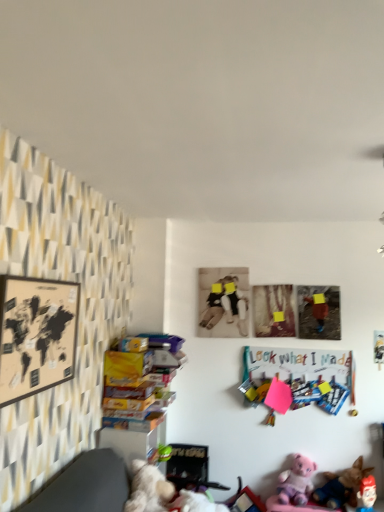
The height and width of the screenshot is (512, 384). Describe the element at coordinates (319, 312) in the screenshot. I see `matte plastic picture frame at upper right, the second picture frame when ordered from front to back` at that location.

What do you see at coordinates (342, 486) in the screenshot?
I see `soft plush dog at lower right, the second toy viewed from the right` at bounding box center [342, 486].

Locate an element on the screen. This screenshot has height=512, width=384. fluffy white teddy bear at lower center, the 1th toy when ordered from left to right is located at coordinates (163, 493).

The height and width of the screenshot is (512, 384). Describe the element at coordinates (296, 481) in the screenshot. I see `pink plush bear at lower right, which is the 2th toy from left to right` at that location.

At what (x,y) coordinates should I click in order to perform the action: click on wooden map at left, which ranks as the first picture frame in front-to-back order. Please return your answer as a coordinate pair (x, y). The image size is (384, 512). Looking at the image, I should click on (36, 335).

Where is `matte plastic picture frame at upper right, the first picture frame viewed from the right`? The width and height of the screenshot is (384, 512). matte plastic picture frame at upper right, the first picture frame viewed from the right is located at coordinates (319, 312).

Is sepia-toned photo at center, arranged as the 2th picture frame when viewed from the left, in contact with fluffy white teddy bear at lower center, acting as the 1th toy starting from the front?

sepia-toned photo at center, arranged as the 2th picture frame when viewed from the left, and fluffy white teddy bear at lower center, acting as the 1th toy starting from the front, are clearly separated.

Consider the image. Is sepia-toned photo at center, which is counted as the third picture frame, starting from the front, looking in the opposite direction of fluffy white teddy bear at lower center, which is the 4th toy in back-to-front order?

sepia-toned photo at center, which is counted as the third picture frame, starting from the front, does not have its back to fluffy white teddy bear at lower center, which is the 4th toy in back-to-front order.

Find the location of `the 2nd picture frame behind the fluffy white teddy bear at lower center, acting as the 1th toy starting from the front, counting from the anchor's position`. the 2nd picture frame behind the fluffy white teddy bear at lower center, acting as the 1th toy starting from the front, counting from the anchor's position is located at coordinates (223, 302).

Is matte plastic picture frame at upper right, the second picture frame when ordered from front to back, positioned with its back to soft plush dog at lower right, arranged as the 3th toy when viewed from the front?

No, matte plastic picture frame at upper right, the second picture frame when ordered from front to back,'s orientation is not away from soft plush dog at lower right, arranged as the 3th toy when viewed from the front.

Considering the sizes of objects matte plastic picture frame at upper right, the 3th picture frame in the left-to-right sequence, and soft plush dog at lower right, arranged as the 3th toy when viewed from the front, in the image provided, who is taller, matte plastic picture frame at upper right, the 3th picture frame in the left-to-right sequence, or soft plush dog at lower right, arranged as the 3th toy when viewed from the front,?

Standing taller between the two is matte plastic picture frame at upper right, the 3th picture frame in the left-to-right sequence.

How much distance is there between matte plastic picture frame at upper right, the first picture frame viewed from the right, and soft plush dog at lower right, placed as the second toy when sorted from back to front?

They are 3.56 feet apart.

Considering the relative positions of matte plastic picture frame at upper right, which is the second picture frame in back-to-front order, and soft plush dog at lower right, the second toy viewed from the right, in the image provided, is matte plastic picture frame at upper right, which is the second picture frame in back-to-front order, to the right of soft plush dog at lower right, the second toy viewed from the right, from the viewer's perspective?

No, matte plastic picture frame at upper right, which is the second picture frame in back-to-front order, is not to the right of soft plush dog at lower right, the second toy viewed from the right.

What's the angular difference between sepia-toned photo at center, which is counted as the third picture frame, starting from the front, and wooden map at left, the 3th picture frame positioned from the back,'s facing directions?

They differ by 89.1 degrees in their facing directions.

Is sepia-toned photo at center, arranged as the 1th picture frame when viewed from the back, turned away from wooden map at left, the 3th picture frame positioned from the right?

That's not correct — sepia-toned photo at center, arranged as the 1th picture frame when viewed from the back, is not looking away from wooden map at left, the 3th picture frame positioned from the right.

Which is more to the left, sepia-toned photo at center, arranged as the 1th picture frame when viewed from the back, or wooden map at left, the 3th picture frame positioned from the right?

wooden map at left, the 3th picture frame positioned from the right, is more to the left.

Could you tell me if wooden map at left, the 3th picture frame positioned from the right, is turned towards sepia-toned photo at center, arranged as the 2th picture frame when viewed from the left?

No.

Measure the distance between wooden map at left, which is counted as the 1th picture frame, starting from the left, and sepia-toned photo at center, arranged as the 2th picture frame when viewed from the left.

wooden map at left, which is counted as the 1th picture frame, starting from the left, is 1.68 meters from sepia-toned photo at center, arranged as the 2th picture frame when viewed from the left.

Is wooden map at left, which is counted as the 1th picture frame, starting from the left, smaller than sepia-toned photo at center, which is counted as the third picture frame, starting from the front?

No.

From a real-world perspective, is soft plush dog at lower right, arranged as the 3th toy when viewed from the front, positioned over pink plush bear at lower right, which appears as the fourth toy when viewed from the front, based on gravity?

Correct, in the physical world, soft plush dog at lower right, arranged as the 3th toy when viewed from the front, is higher than pink plush bear at lower right, which appears as the fourth toy when viewed from the front.

Considering the positions of objects soft plush dog at lower right, which appears as the third toy when viewed from the left, and pink plush bear at lower right, which appears as the fourth toy when viewed from the front, in the image provided, who is more to the right, soft plush dog at lower right, which appears as the third toy when viewed from the left, or pink plush bear at lower right, which appears as the fourth toy when viewed from the front,?

soft plush dog at lower right, which appears as the third toy when viewed from the left.

Does soft plush dog at lower right, placed as the second toy when sorted from back to front, turn towards pink plush bear at lower right, acting as the 3th toy starting from the right?

No, soft plush dog at lower right, placed as the second toy when sorted from back to front, is not aimed at pink plush bear at lower right, acting as the 3th toy starting from the right.

Would you consider soft plush dog at lower right, placed as the second toy when sorted from back to front, to be distant from pink plush bear at lower right, which is the 2th toy from left to right?

No.

Where is `bulletin board below the sepia-toned photo at center, which is counted as the third picture frame, starting from the front (from the image's perspective)`? This screenshot has height=512, width=384. bulletin board below the sepia-toned photo at center, which is counted as the third picture frame, starting from the front (from the image's perspective) is located at coordinates (297, 379).

Is sepia-toned photo at center, arranged as the 1th picture frame when viewed from the back, not inside colorful paperboard at center right?

That's correct, sepia-toned photo at center, arranged as the 1th picture frame when viewed from the back, is outside of colorful paperboard at center right.

In the image, is sepia-toned photo at center, arranged as the 2th picture frame when viewed from the left, positioned in front of or behind colorful paperboard at center right?

sepia-toned photo at center, arranged as the 2th picture frame when viewed from the left, is behind colorful paperboard at center right.

Is colorful paperboard at center right positioned far away from fluffy white teddy bear at lower center, which is the 4th toy in back-to-front order?

Indeed, colorful paperboard at center right is not near fluffy white teddy bear at lower center, which is the 4th toy in back-to-front order.

In terms of width, does colorful paperboard at center right look wider or thinner when compared to fluffy white teddy bear at lower center, positioned as the fourth toy in right-to-left order?

Considering their sizes, colorful paperboard at center right looks slimmer than fluffy white teddy bear at lower center, positioned as the fourth toy in right-to-left order.

Does point (351, 365) come farther from viewer compared to point (138, 482)?

Yes, point (351, 365) is behind point (138, 482).

Can you confirm if colorful paperboard at center right is smaller than fluffy white teddy bear at lower center, which is the 4th toy in back-to-front order?

Indeed, colorful paperboard at center right has a smaller size compared to fluffy white teddy bear at lower center, which is the 4th toy in back-to-front order.

From the image's perspective, starting from the sepia-toned photo at center, arranged as the 2th picture frame when viewed from the left, which toy is the 1st one below? Please provide its 2D coordinates.

[(163, 493)]

From the matte plastic picture frame at upper right, the first picture frame viewed from the right, count 2nd toys forward and point to it. Please provide its 2D coordinates.

[(342, 486)]

Based on their spatial positions, is wooden map at left, which ranks as the first picture frame in front-to-back order, or plush pink bear at lower right, marked as the 3th toy in a back-to-front arrangement, further from matte plastic picture frame at upper right, which is the second picture frame in back-to-front order?

wooden map at left, which ranks as the first picture frame in front-to-back order, is further to matte plastic picture frame at upper right, which is the second picture frame in back-to-front order.

Looking at the image, which one is located further to soft plush dog at lower right, the second toy viewed from the right, fluffy white teddy bear at lower center, which is the 4th toy in back-to-front order, or colorful paperboard at center right?

Among the two, fluffy white teddy bear at lower center, which is the 4th toy in back-to-front order, is located further to soft plush dog at lower right, the second toy viewed from the right.

In the scene shown: Considering their positions, is plush pink bear at lower right, marked as the 3th toy in a back-to-front arrangement, positioned further to wooden map at left, which is counted as the 1th picture frame, starting from the left, than colorful paperboard at center right?

Among the two, plush pink bear at lower right, marked as the 3th toy in a back-to-front arrangement, is located further to wooden map at left, which is counted as the 1th picture frame, starting from the left.

Looking at the image, which one is located further to wooden map at left, which is counted as the 1th picture frame, starting from the left, plush pink bear at lower right, marked as the 3th toy in a back-to-front arrangement, or sepia-toned photo at center, arranged as the 1th picture frame when viewed from the back?

plush pink bear at lower right, marked as the 3th toy in a back-to-front arrangement, lies further to wooden map at left, which is counted as the 1th picture frame, starting from the left, than the other object.

Which object lies nearer to the anchor point matte plastic picture frame at upper right, which is the second picture frame in back-to-front order, fluffy white teddy bear at lower center, which is the 4th toy in back-to-front order, or pink plush bear at lower right, which appears as the fourth toy when viewed from the front?

The object closer to matte plastic picture frame at upper right, which is the second picture frame in back-to-front order, is pink plush bear at lower right, which appears as the fourth toy when viewed from the front.

Looking at the image, which one is located further to colorful paperboard at center right, pink plush bear at lower right, the 1th toy viewed from the back, or sepia-toned photo at center, which is counted as the third picture frame, starting from the front?

Among the two, pink plush bear at lower right, the 1th toy viewed from the back, is located further to colorful paperboard at center right.

From the image, which object appears to be farther from pink plush bear at lower right, the 1th toy viewed from the back, matte plastic picture frame at upper right, the 3th picture frame in the left-to-right sequence, or plush pink bear at lower right, the 4th toy from the left?

Based on the image, matte plastic picture frame at upper right, the 3th picture frame in the left-to-right sequence, appears to be further to pink plush bear at lower right, the 1th toy viewed from the back.

Which object lies nearer to the anchor point sepia-toned photo at center, arranged as the 2th picture frame when viewed from the left, soft plush dog at lower right, arranged as the 3th toy when viewed from the front, or pink plush bear at lower right, which is the 2th toy from left to right?

pink plush bear at lower right, which is the 2th toy from left to right, is positioned closer to the anchor sepia-toned photo at center, arranged as the 2th picture frame when viewed from the left.

You are a GUI agent. You are given a task and a screenshot of the screen. Output one action in this format:
    pyautogui.click(x=<x>, y=<y>)
    Task: Click on the bulletin board between matte plastic picture frame at upper right, the first picture frame viewed from the right, and soft plush dog at lower right, arranged as the 3th toy when viewed from the front, in the up-down direction
    
    Given the screenshot: What is the action you would take?
    pyautogui.click(x=297, y=379)

Find the location of a particular element. This screenshot has width=384, height=512. bulletin board between sepia-toned photo at center, which is counted as the third picture frame, starting from the front, and pink plush bear at lower right, which is the 2th toy from left to right, vertically is located at coordinates (297, 379).

I want to click on bulletin board between wooden map at left, which ranks as the first picture frame in front-to-back order, and sepia-toned photo at center, arranged as the 2th picture frame when viewed from the left, from front to back, so click(297, 379).

Locate an element on the screen. The height and width of the screenshot is (512, 384). bulletin board between matte plastic picture frame at upper right, the first picture frame viewed from the right, and pink plush bear at lower right, acting as the 3th toy starting from the right, in the vertical direction is located at coordinates pyautogui.click(x=297, y=379).